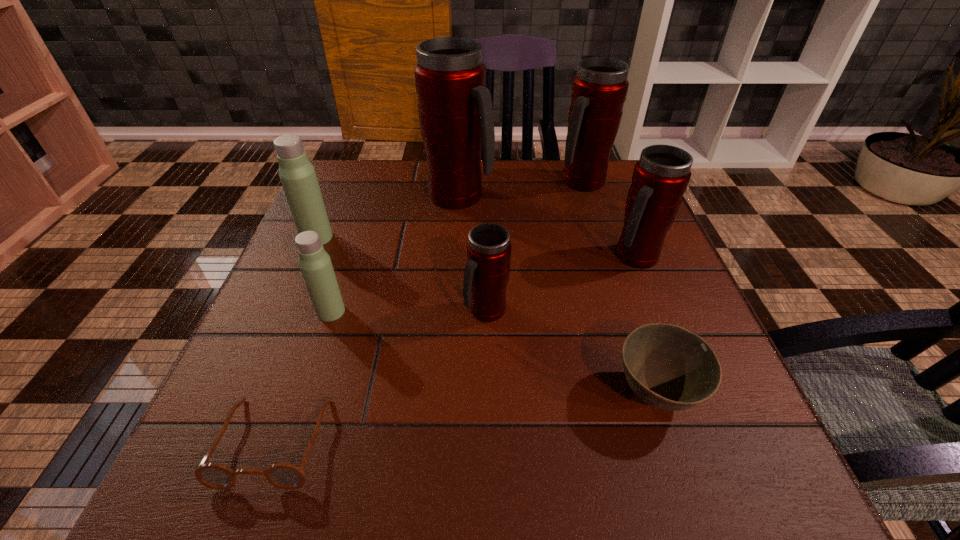
Where is `the seventh tallest object`? the seventh tallest object is located at coordinates (668, 367).

Identify the location of spectacles. click(285, 476).

Locate an element on the screen. The height and width of the screenshot is (540, 960). vacant region located 0.070m on the side with the handle of the biggest red thermos bottle is located at coordinates (520, 196).

Locate an element on the screen. vacant point located on the side with the handle of the seventh shortest object is located at coordinates (603, 248).

Image resolution: width=960 pixels, height=540 pixels. Identify the location of vacant space located on the front of the bigger light thermos bottle. (250, 390).

Locate an element on the screen. vacant space positioned 0.330m on the side with the handle of the third biggest red thermos bottle is located at coordinates (700, 420).

Locate an element on the screen. The height and width of the screenshot is (540, 960). free space located on the side with the handle of the nearest red thermos bottle is located at coordinates (487, 359).

Identify the location of vacant space situated on the right of the smaller light thermos bottle. (475, 312).

Locate an element on the screen. This screenshot has width=960, height=540. free spot located 0.130m on the left of the second shortest object is located at coordinates (531, 394).

Identify the location of object that is at the near edge. (285, 476).